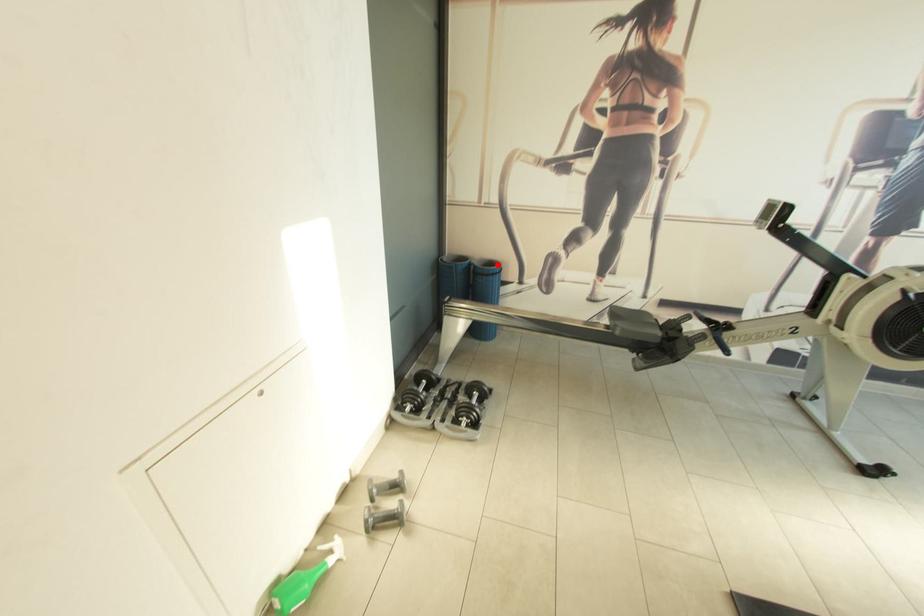
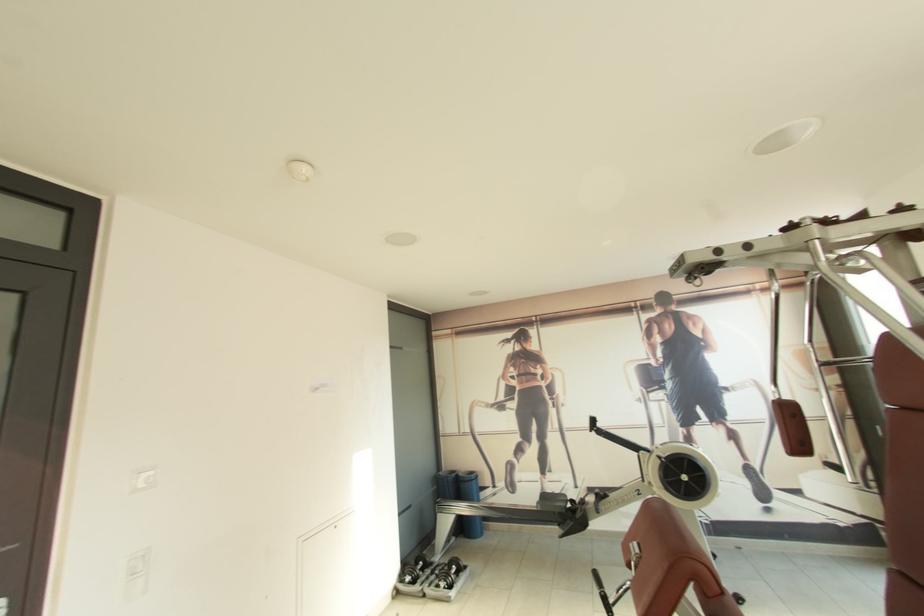
In the second image, find the point that corresponds to the highlighted location in the first image.

(476, 475)